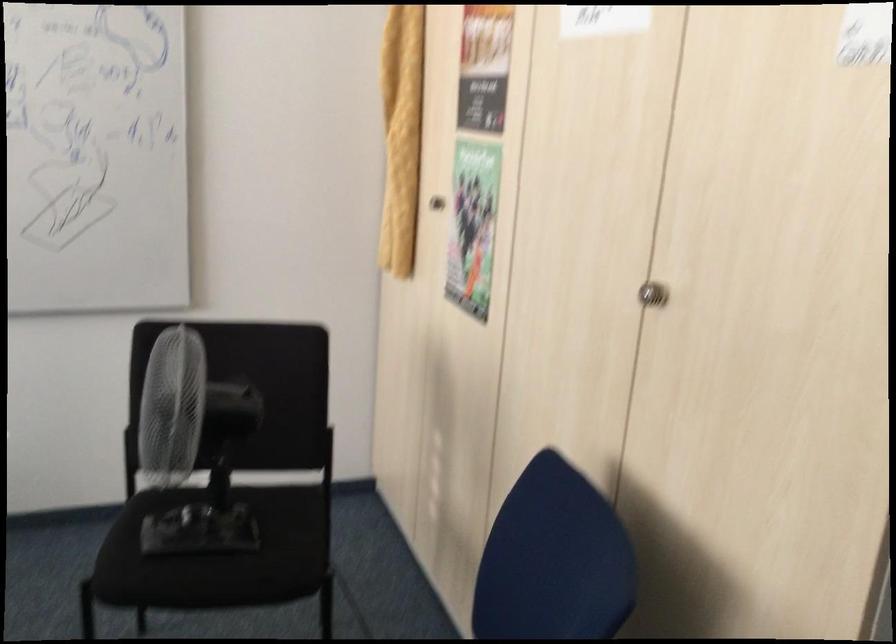
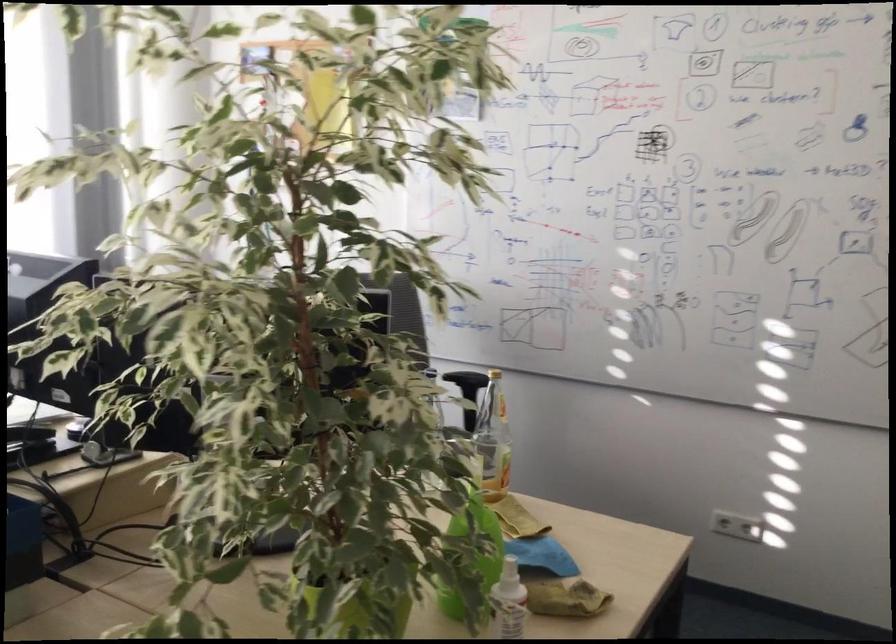
Question: Based on the continuous images, in which direction is the camera rotating? Reply with the corresponding letter.

Choices:
 (A) Left
 (B) Right
 (C) Up
 (D) Down

Answer: (A)